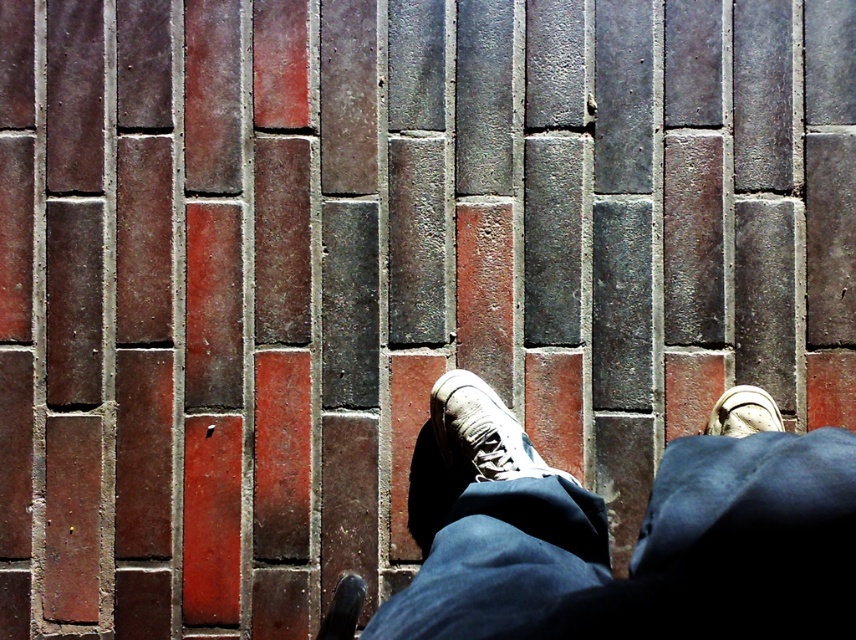
Question: Which of the following is the farthest from the observer?

Choices:
 (A) (485, 515)
 (B) (765, 413)
 (C) (333, 595)
 (D) (443, 412)

Answer: (C)

Question: Which object is positioned closest to the white suede shoe at lower right?

Choices:
 (A) shiny black shoe at lower center
 (B) white canvas shoe at center

Answer: (B)

Question: Considering the real-world distances, which object is closest to the dark blue denim jeans at center?

Choices:
 (A) white canvas shoe at center
 (B) shiny black shoe at lower center
 (C) white suede shoe at lower right

Answer: (A)

Question: Is white canvas shoe at center wider than shiny black shoe at lower center?

Choices:
 (A) no
 (B) yes

Answer: (B)

Question: Where is dark blue denim jeans at center located in relation to white suede shoe at lower right in the image?

Choices:
 (A) right
 (B) left

Answer: (B)

Question: Can you confirm if dark blue denim jeans at center is wider than shiny black shoe at lower center?

Choices:
 (A) yes
 (B) no

Answer: (A)